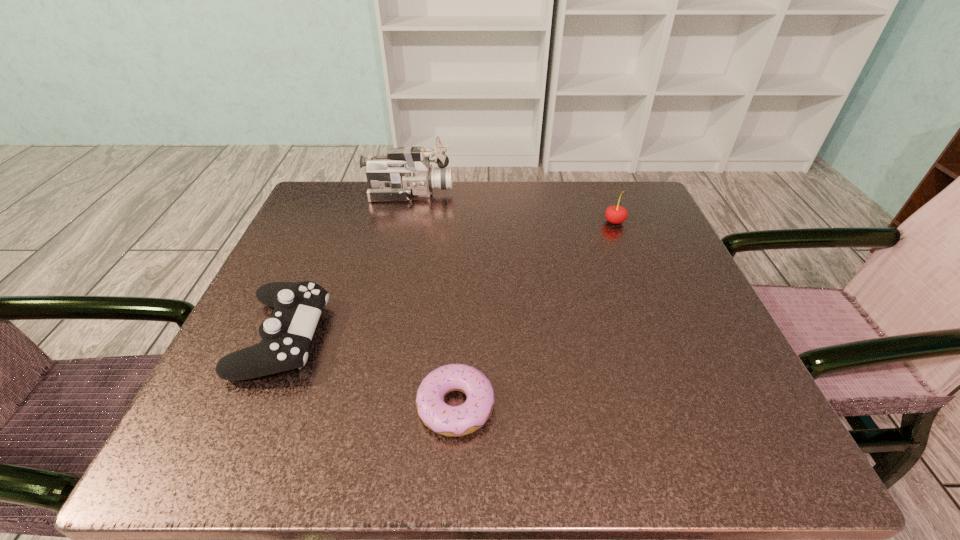
Locate an element on the screen. The image size is (960, 540). free spot between the farthest object and the second shortest object is located at coordinates (347, 265).

What are the coordinates of `vacant area that lies between the third shortest object and the shortest object` in the screenshot? It's located at (535, 314).

This screenshot has height=540, width=960. In order to click on empty space that is in between the shortest object and the cherry in this screenshot , I will do `click(535, 314)`.

Locate an element on the screen. This screenshot has height=540, width=960. vacant space in between the shortest object and the cherry is located at coordinates (535, 314).

Locate an element on the screen. The height and width of the screenshot is (540, 960). free spot between the camcorder and the third shortest object is located at coordinates (512, 207).

Image resolution: width=960 pixels, height=540 pixels. Find the location of `object that can be found as the closest to the tallest object`. object that can be found as the closest to the tallest object is located at coordinates (286, 335).

Identify the location of object that is the third closest to the tallest object. This screenshot has width=960, height=540. (452, 421).

This screenshot has height=540, width=960. Find the location of `vacant region that satisfies the following two spatial constraints: 1. on the front-facing side of the rightmost object; 2. on the right side of the camcorder`. vacant region that satisfies the following two spatial constraints: 1. on the front-facing side of the rightmost object; 2. on the right side of the camcorder is located at coordinates (403, 222).

This screenshot has width=960, height=540. Identify the location of free region that satisfies the following two spatial constraints: 1. on the front-facing side of the rightmost object; 2. on the right side of the camcorder. (403, 222).

Image resolution: width=960 pixels, height=540 pixels. I want to click on free location that satisfies the following two spatial constraints: 1. on the back side of the shortest object; 2. on the surface of the control, so [x=459, y=336].